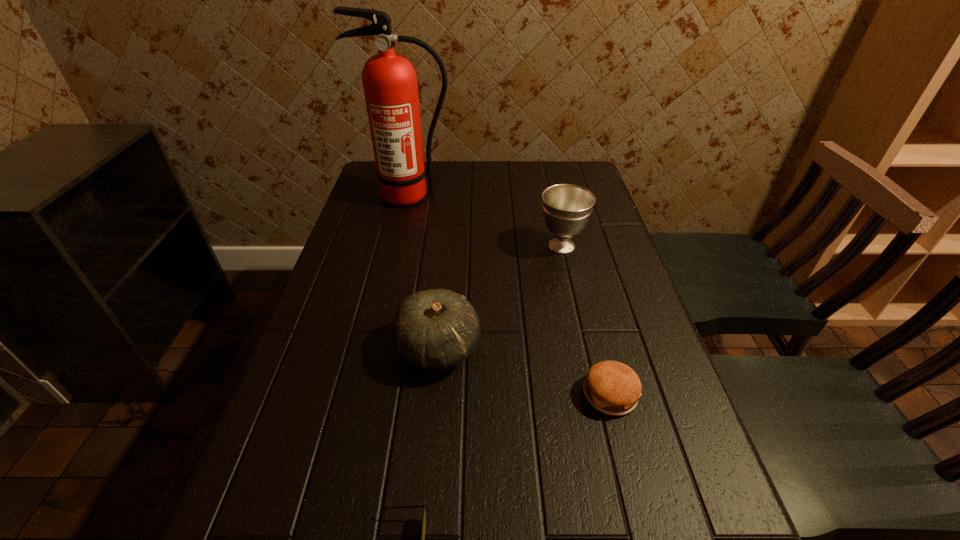
Where is `vacant area between the tallest object and the hamburger`? This screenshot has height=540, width=960. vacant area between the tallest object and the hamburger is located at coordinates (510, 295).

This screenshot has width=960, height=540. Find the location of `free space that is in between the farthest object and the gourd`. free space that is in between the farthest object and the gourd is located at coordinates (424, 273).

Find the location of `the third closest object to the gourd`. the third closest object to the gourd is located at coordinates (566, 208).

What are the coordinates of `object that is the nearest to the farthest object` in the screenshot? It's located at (566, 208).

Find the location of a particular element. The image size is (960, 540). free spot that satisfies the following two spatial constraints: 1. on the handle side of the farthest object; 2. on the right side of the gourd is located at coordinates (374, 348).

The height and width of the screenshot is (540, 960). What are the coordinates of `vacant space that satisfies the following two spatial constraints: 1. on the handle side of the hamburger; 2. on the left side of the fire extinguisher` in the screenshot? It's located at (364, 394).

Image resolution: width=960 pixels, height=540 pixels. I want to click on vacant region that satisfies the following two spatial constraints: 1. on the handle side of the hamburger; 2. on the right side of the fire extinguisher, so click(x=364, y=394).